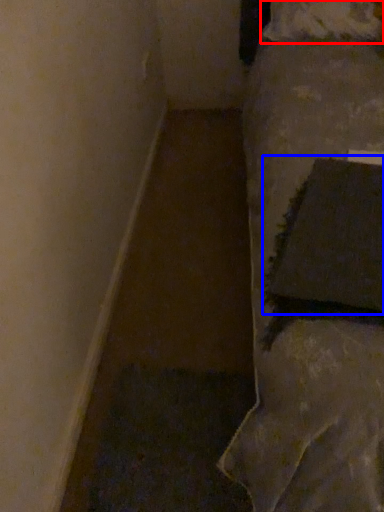
Question: Which point is closer to the camera, pillow (highlighted by a red box) or pillow (highlighted by a blue box)?

Choices:
 (A) pillow
 (B) pillow

Answer: (B)